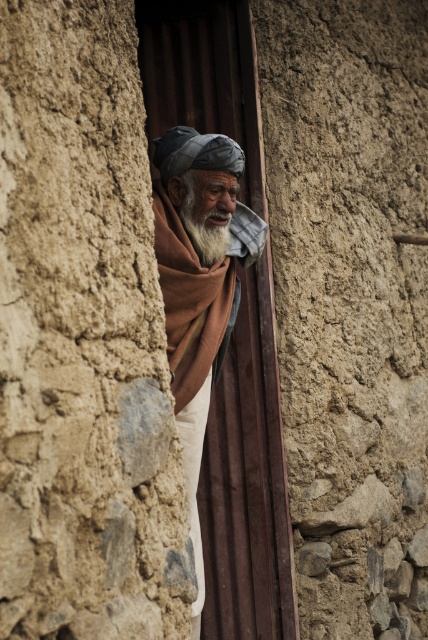
Can you confirm if brown woven scarf at center is smaller than white soft beard at center?

Actually, brown woven scarf at center might be larger than white soft beard at center.

Does point (177, 406) come behind point (219, 241)?

That is False.

Locate an element on the screen. brown woven scarf at center is located at coordinates (189, 300).

Is brown woolen scarf at center below brown woven scarf at center?

Yes, brown woolen scarf at center is below brown woven scarf at center.

Who is higher up, brown woolen scarf at center or brown woven scarf at center?

brown woven scarf at center is higher up.

Who is more forward, (199, 592) or (219, 326)?

Point (199, 592) is in front.

You are a GUI agent. You are given a task and a screenshot of the screen. Output one action in this format:
    pyautogui.click(x=<x>, y=<y>)
    Task: Click on the brown woolen scarf at center
    
    Given the screenshot: What is the action you would take?
    pyautogui.click(x=199, y=275)

Is brown woolen scarf at center below white soft beard at center?

Yes.

Is brown woolen scarf at center taller than white soft beard at center?

Yes, brown woolen scarf at center is taller than white soft beard at center.

Who is more forward, (184,243) or (207,227)?

Point (184,243)

Locate an element on the screen. The width and height of the screenshot is (428, 640). brown woolen scarf at center is located at coordinates (199, 275).